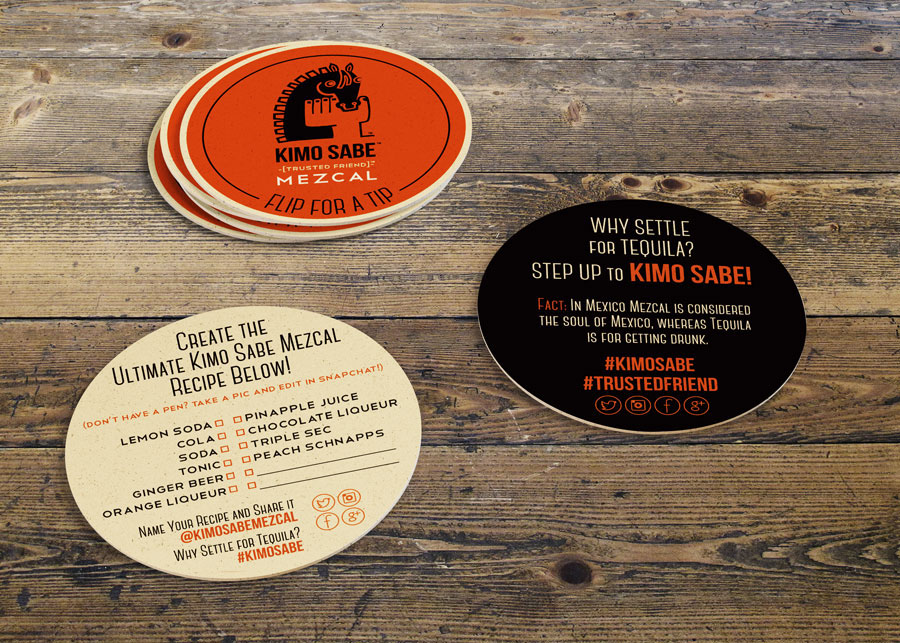
Locate an element on the screen. The height and width of the screenshot is (643, 900). light color perimeter stripe of orange coasters is located at coordinates (200, 222), (221, 219), (184, 184), (186, 161).